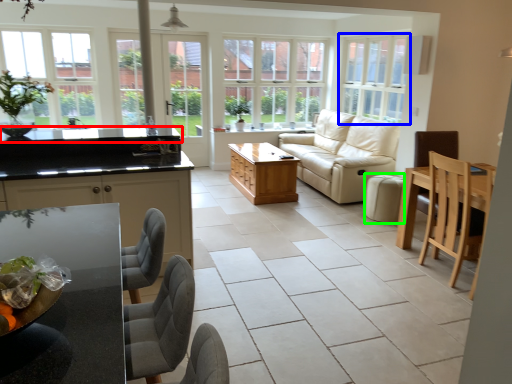
Question: Based on their relative distances, which object is farther from countertop (highlighted by a red box)? Choose from window (highlighted by a blue box) and bar stool (highlighted by a green box).

Choices:
 (A) window
 (B) bar stool

Answer: (B)